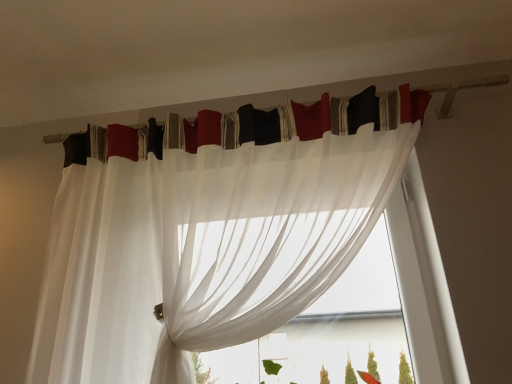
Question: From a real-world perspective, relative to sheer white curtain at upper center, arranged as the 2th curtain when viewed from the top, is white sheer curtain at upper center, the second curtain positioned from the bottom, vertically above or below?

Choices:
 (A) below
 (B) above

Answer: (B)

Question: Considering the relative positions of white sheer curtain at upper center, the second curtain positioned from the bottom, and sheer white curtain at upper center, arranged as the 2th curtain when viewed from the top, in the image provided, is white sheer curtain at upper center, the second curtain positioned from the bottom, to the left or to the right of sheer white curtain at upper center, arranged as the 2th curtain when viewed from the top,?

Choices:
 (A) right
 (B) left

Answer: (A)

Question: Which of these objects is positioned closest to the sheer white curtain at center?

Choices:
 (A) white sheer curtain at upper center, which is the first curtain in top-to-bottom order
 (B) sheer white curtain at upper center, arranged as the 2th curtain when viewed from the top

Answer: (B)

Question: Based on their relative distances, which object is farther from the sheer white curtain at center?

Choices:
 (A) sheer white curtain at upper center, arranged as the 2th curtain when viewed from the top
 (B) white sheer curtain at upper center, which is the first curtain in top-to-bottom order

Answer: (B)